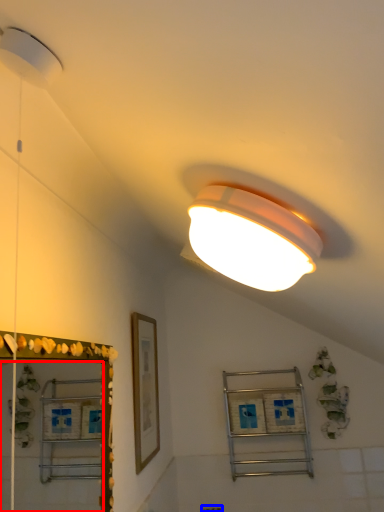
Question: Which object is further to the camera taking this photo, mirror (highlighted by a red box) or electric outlet (highlighted by a blue box)?

Choices:
 (A) mirror
 (B) electric outlet

Answer: (B)